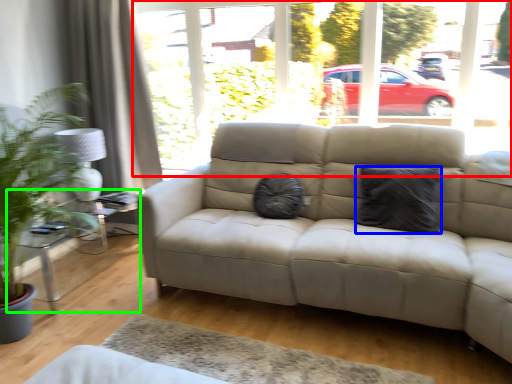
Question: Which object is the farthest from window frame (highlighted by a red box)? Choose among these: pillow (highlighted by a blue box) or table (highlighted by a green box).

Choices:
 (A) pillow
 (B) table

Answer: (B)